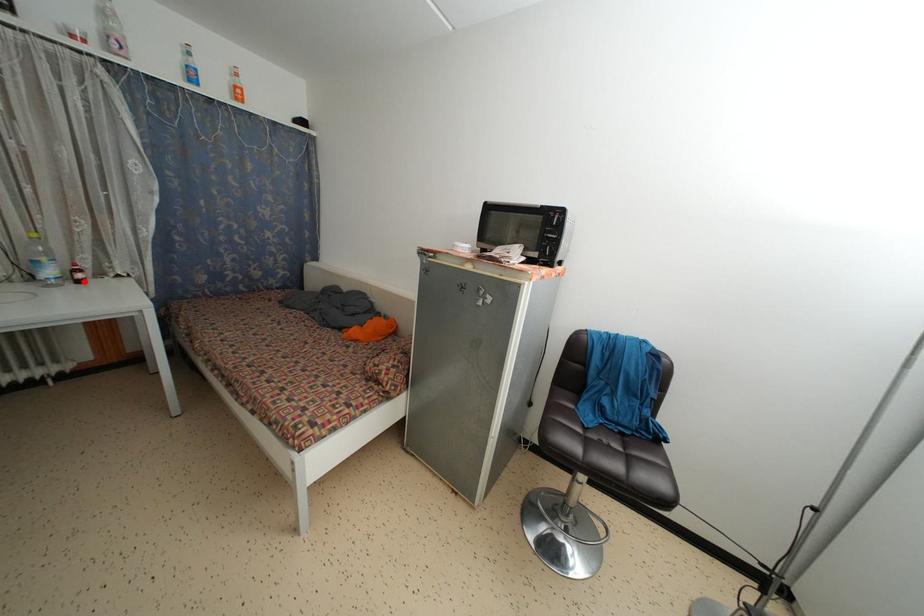
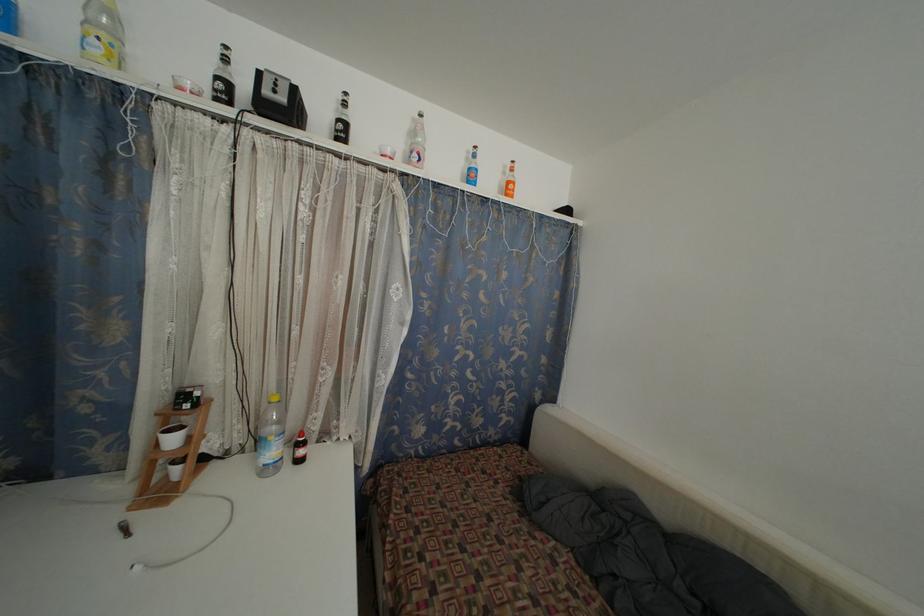
Locate, in the second image, the point that corresponds to the highlighted location in the first image.

(305, 458)